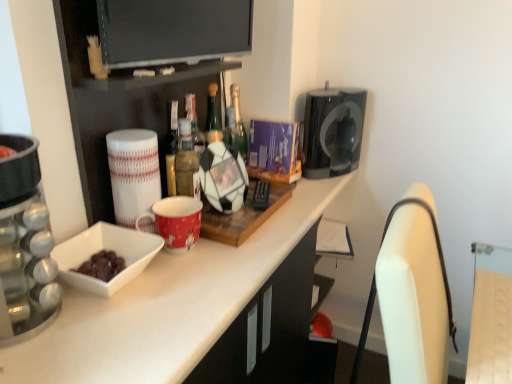
Question: Can you confirm if light brown wood swivel chair at right, arranged as the second swivel chair when ordered from the bottom, is thinner than red glossy mug at center?

Choices:
 (A) no
 (B) yes

Answer: (A)

Question: Considering the relative sizes of light brown wood swivel chair at right, arranged as the second swivel chair when ordered from the bottom, and red glossy mug at center in the image provided, is light brown wood swivel chair at right, arranged as the second swivel chair when ordered from the bottom, shorter than red glossy mug at center?

Choices:
 (A) no
 (B) yes

Answer: (B)

Question: Does light brown wood swivel chair at right, arranged as the second swivel chair when ordered from the bottom, come behind red glossy mug at center?

Choices:
 (A) no
 (B) yes

Answer: (A)

Question: Is light brown wood swivel chair at right, marked as the 1th swivel chair in a top-to-bottom arrangement, facing towards red glossy mug at center?

Choices:
 (A) yes
 (B) no

Answer: (B)

Question: Can you confirm if light brown wood swivel chair at right, arranged as the second swivel chair when ordered from the bottom, is taller than red glossy mug at center?

Choices:
 (A) yes
 (B) no

Answer: (B)

Question: Is light brown wood swivel chair at right, marked as the 1th swivel chair in a top-to-bottom arrangement, positioned with its back to red glossy mug at center?

Choices:
 (A) yes
 (B) no

Answer: (B)

Question: Considering the relative sizes of flat screen tv at upper center and white glossy countertop at center in the image provided, is flat screen tv at upper center wider than white glossy countertop at center?

Choices:
 (A) no
 (B) yes

Answer: (A)

Question: Is flat screen tv at upper center positioned beyond the bounds of white glossy countertop at center?

Choices:
 (A) no
 (B) yes

Answer: (B)

Question: Does flat screen tv at upper center appear on the right side of white glossy countertop at center?

Choices:
 (A) yes
 (B) no

Answer: (B)

Question: Is flat screen tv at upper center thinner than white glossy countertop at center?

Choices:
 (A) no
 (B) yes

Answer: (B)

Question: Is flat screen tv at upper center to the left of white glossy countertop at center from the viewer's perspective?

Choices:
 (A) no
 (B) yes

Answer: (B)

Question: Considering the relative sizes of flat screen tv at upper center and white glossy countertop at center in the image provided, is flat screen tv at upper center smaller than white glossy countertop at center?

Choices:
 (A) no
 (B) yes

Answer: (B)

Question: Considering the relative positions of flat screen tv at upper center and light brown wood swivel chair at right, arranged as the second swivel chair when ordered from the bottom, in the image provided, is flat screen tv at upper center in front of light brown wood swivel chair at right, arranged as the second swivel chair when ordered from the bottom,?

Choices:
 (A) no
 (B) yes

Answer: (A)